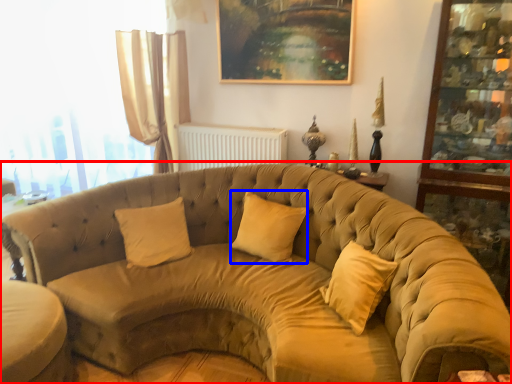
Question: Which object appears farthest to the camera in this image, studio couch (highlighted by a red box) or pillow (highlighted by a blue box)?

Choices:
 (A) studio couch
 (B) pillow

Answer: (B)